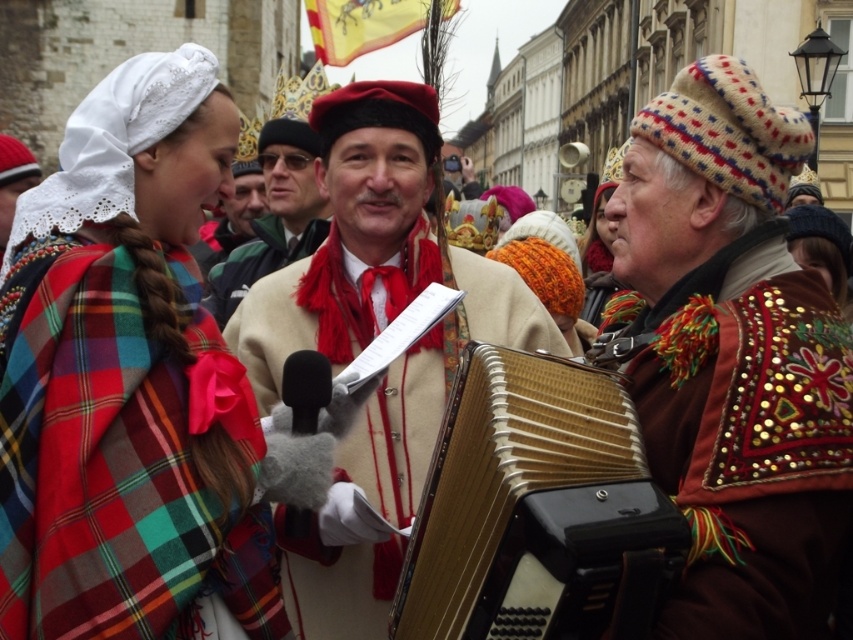
Can you confirm if shiny gold accordion at center is positioned above gold metallic accordion at center?

Indeed, shiny gold accordion at center is positioned over gold metallic accordion at center.

Between shiny gold accordion at center and gold metallic accordion at center, which one appears on the right side from the viewer's perspective?

Positioned to the right is shiny gold accordion at center.

Where is `shiny gold accordion at center`? The image size is (853, 640). shiny gold accordion at center is located at coordinates (735, 356).

Does shiny gold accordion at center have a lesser width compared to beige wool coat at center?

In fact, shiny gold accordion at center might be wider than beige wool coat at center.

Between shiny gold accordion at center and beige wool coat at center, which one appears on the right side from the viewer's perspective?

Positioned to the right is shiny gold accordion at center.

Who is more distant from viewer, (701,413) or (270,170)?

The point (270,170) is behind.

I want to click on shiny gold accordion at center, so click(x=735, y=356).

Looking at this image, who is taller, plaid fabric shawl at left or gold metallic accordion at center?

With more height is plaid fabric shawl at left.

Is plaid fabric shawl at left taller than gold metallic accordion at center?

Indeed, plaid fabric shawl at left has a greater height compared to gold metallic accordion at center.

Who is more distant from viewer, [186,532] or [653,492]?

The point [186,532] is behind.

You are a GUI agent. You are given a task and a screenshot of the screen. Output one action in this format:
    pyautogui.click(x=<x>, y=<y>)
    Task: Click on the plaid fabric shawl at left
    This screenshot has width=853, height=640.
    Given the screenshot: What is the action you would take?
    pyautogui.click(x=120, y=374)